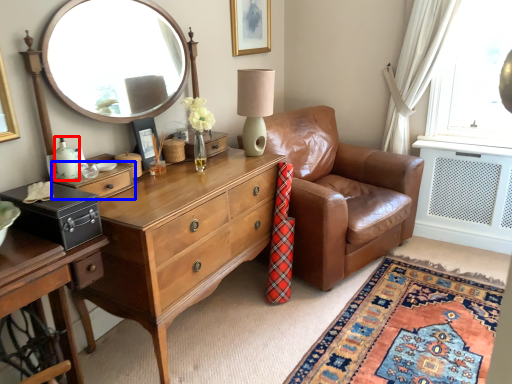
Question: Which object is further to the camera taking this photo, bottle (highlighted by a red box) or drawer (highlighted by a blue box)?

Choices:
 (A) bottle
 (B) drawer

Answer: (B)